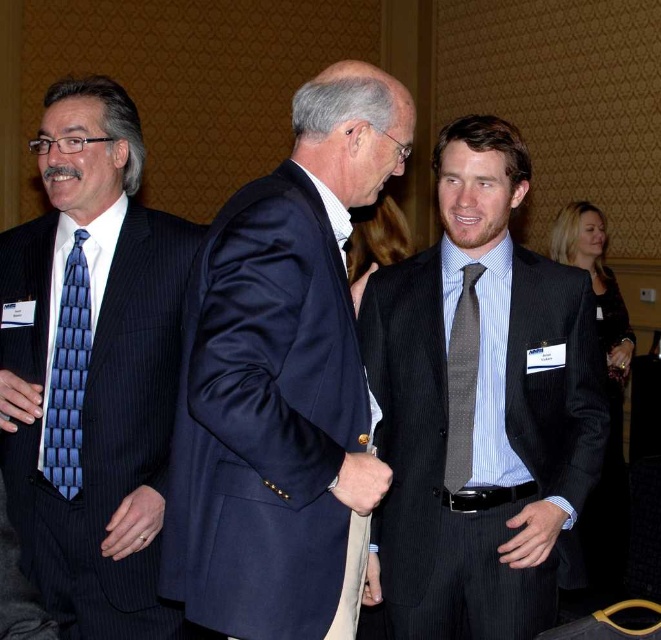
Is blue woven tie at left shorter than gray textured tie at center?

No.

Based on the photo, which is above, blue woven tie at left or gray textured tie at center?

blue woven tie at left

The height and width of the screenshot is (640, 661). I want to click on blue woven tie at left, so click(67, 376).

Consider the image. Who is more distant from viewer, (x=494, y=340) or (x=59, y=445)?

The point (x=59, y=445) is more distant.

Does gray striped suit at right have a lesser height compared to blue textured tie at left?

Correct, gray striped suit at right is not as tall as blue textured tie at left.

Where is `gray striped suit at right`? This screenshot has width=661, height=640. gray striped suit at right is located at coordinates (479, 406).

I want to click on gray striped suit at right, so click(x=479, y=406).

At what (x,y) coordinates should I click in order to perform the action: click on navy blue suit at center. Please return your answer as a coordinate pair (x, y). The width and height of the screenshot is (661, 640). Looking at the image, I should click on (280, 376).

Describe the element at coordinates (280, 376) in the screenshot. I see `navy blue suit at center` at that location.

Where is `navy blue suit at center`? The height and width of the screenshot is (640, 661). navy blue suit at center is located at coordinates pos(280,376).

Image resolution: width=661 pixels, height=640 pixels. I want to click on navy blue suit at center, so click(x=280, y=376).